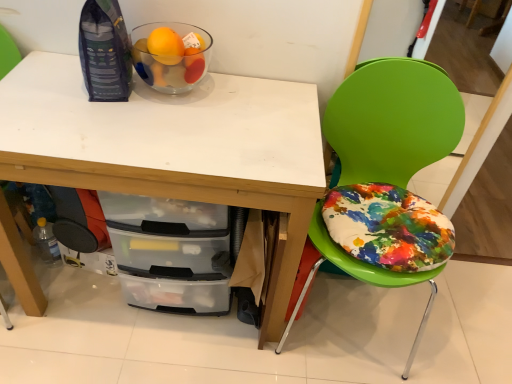
Question: Should I look upward or downward to see clear plastic bottle at lower left?

Choices:
 (A) up
 (B) down

Answer: (B)

Question: Is green plastic chair at right at the left side of white matte desk at upper center?

Choices:
 (A) yes
 (B) no

Answer: (B)

Question: From a real-world perspective, is green plastic chair at right physically below white matte desk at upper center?

Choices:
 (A) yes
 (B) no

Answer: (B)

Question: Is green plastic chair at right thinner than white matte desk at upper center?

Choices:
 (A) yes
 (B) no

Answer: (B)

Question: Is white matte desk at upper center inside green plastic chair at right?

Choices:
 (A) no
 (B) yes

Answer: (A)

Question: Does green plastic chair at right come in front of white matte desk at upper center?

Choices:
 (A) no
 (B) yes

Answer: (B)

Question: Is green plastic chair at right positioned with its back to white matte desk at upper center?

Choices:
 (A) no
 (B) yes

Answer: (A)

Question: Is white matte desk at upper center facing away from transparent glass bowl at upper left?

Choices:
 (A) yes
 (B) no

Answer: (B)

Question: Is white matte desk at upper center further to camera compared to transparent glass bowl at upper left?

Choices:
 (A) yes
 (B) no

Answer: (B)

Question: From a real-world perspective, is white matte desk at upper center positioned over transparent glass bowl at upper left based on gravity?

Choices:
 (A) yes
 (B) no

Answer: (B)

Question: Is white matte desk at upper center not inside transparent glass bowl at upper left?

Choices:
 (A) no
 (B) yes

Answer: (B)

Question: Does white matte desk at upper center have a greater width compared to transparent glass bowl at upper left?

Choices:
 (A) yes
 (B) no

Answer: (A)

Question: Does white matte desk at upper center turn towards transparent glass bowl at upper left?

Choices:
 (A) no
 (B) yes

Answer: (A)

Question: Is clear plastic bottle at lower left completely or partially outside of transparent glass bowl at upper left?

Choices:
 (A) no
 (B) yes

Answer: (B)